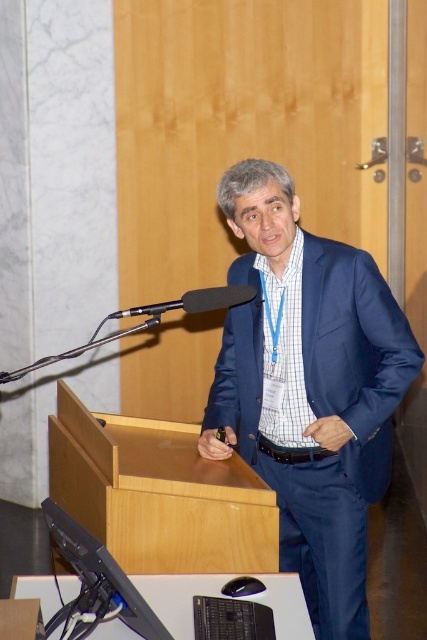
Who is lower down, blue satin suit at center or black matte microphone at center?

blue satin suit at center is below.

Looking at this image, which is more to the left, blue satin suit at center or black matte microphone at center?

black matte microphone at center is more to the left.

Locate an element on the screen. Image resolution: width=427 pixels, height=640 pixels. blue satin suit at center is located at coordinates (310, 388).